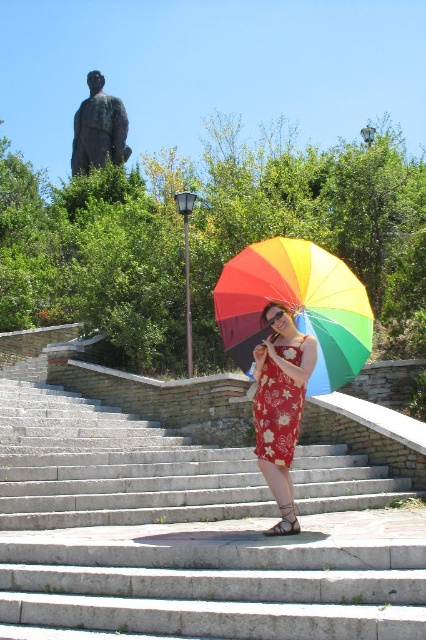
Which is above, rainbow fabric umbrella at center or floral printed fabric dress at center?

Positioned higher is rainbow fabric umbrella at center.

Does point (333, 374) come farther from viewer compared to point (256, 384)?

Yes, point (333, 374) is farther from viewer.

Identify the location of rainbow fabric umbrella at center. (296, 307).

Is point (267, 368) closer to camera compared to point (287, 424)?

No.

Who is more forward, (x=282, y=368) or (x=276, y=404)?

Positioned in front is point (x=282, y=368).

I want to click on floral dress at center, so click(281, 406).

What do you see at coordinates (189, 532) in the screenshot?
I see `gray concrete stairs at center` at bounding box center [189, 532].

Looking at this image, is gray concrete stairs at center wider than rainbow fabric umbrella at center?

Indeed, gray concrete stairs at center has a greater width compared to rainbow fabric umbrella at center.

Identify the location of gray concrete stairs at center. The width and height of the screenshot is (426, 640). (189, 532).

Identify the location of gray concrete stairs at center. (189, 532).